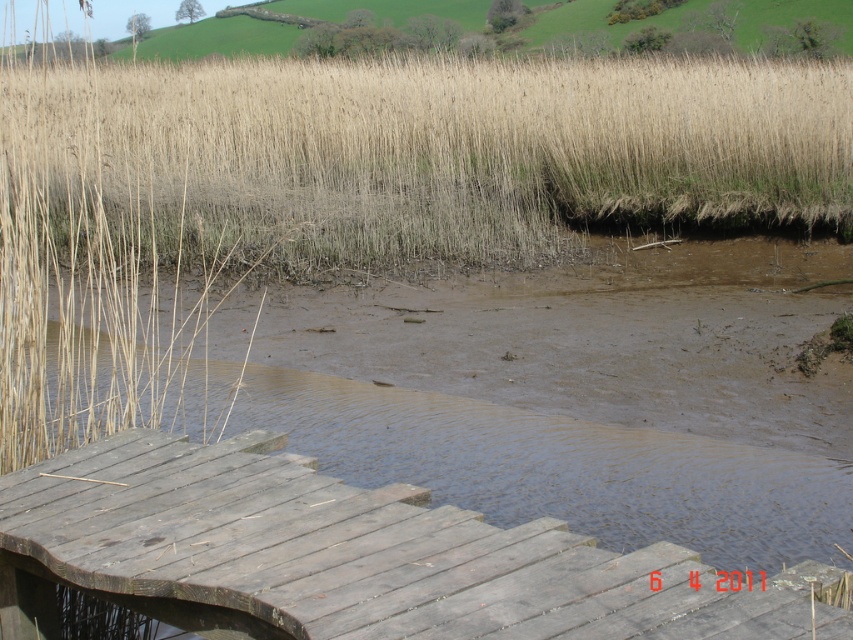
You are standing on the wooden boardwalk in the wetland scene. You notice two points marked in the image. The first point is at coordinates point (227, 188) and the second is at point (24, 609). If you were to walk towards both points, which one would you reach first?

Point (227, 188) is closer to you than point (24, 609), so you would reach it first.